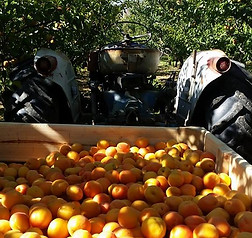
In order to click on 1 right side of wooden container in this screenshot , I will do `click(237, 171)`.